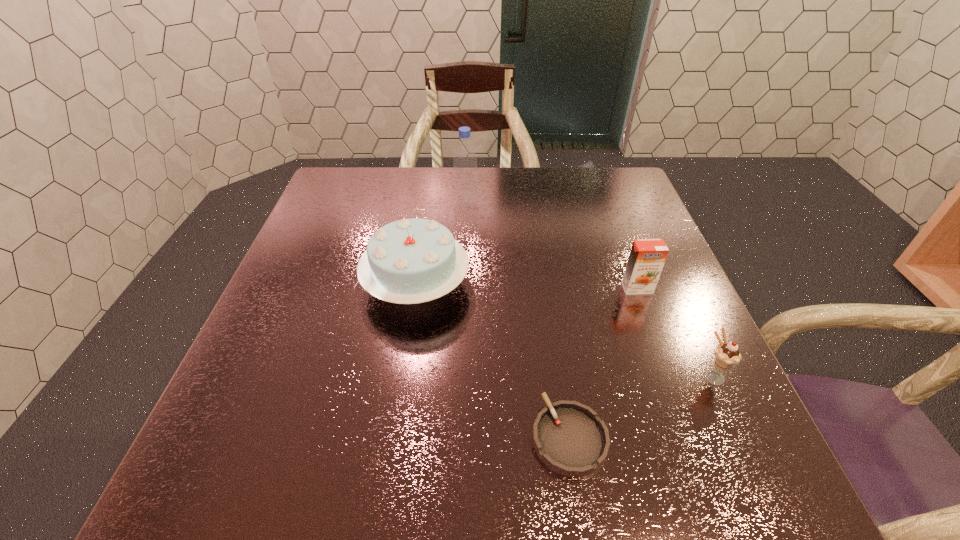
Where is `vacant space situated on the back of the orange juice`? Image resolution: width=960 pixels, height=540 pixels. vacant space situated on the back of the orange juice is located at coordinates (616, 231).

Where is `vacant space positioned 0.280m on the back of the second nearest object`? The width and height of the screenshot is (960, 540). vacant space positioned 0.280m on the back of the second nearest object is located at coordinates (663, 266).

Where is `vacant space located 0.060m on the back of the nearest object`? vacant space located 0.060m on the back of the nearest object is located at coordinates (559, 373).

Where is `object that is at the far edge`? The width and height of the screenshot is (960, 540). object that is at the far edge is located at coordinates (466, 194).

This screenshot has height=540, width=960. Find the location of `object situated at the near edge`. object situated at the near edge is located at coordinates (569, 438).

The width and height of the screenshot is (960, 540). I want to click on orange juice at the right edge, so click(647, 257).

This screenshot has height=540, width=960. I want to click on icecream located at the right edge, so click(x=726, y=355).

Locate an element on the screen. vacant space at the far edge is located at coordinates (415, 194).

Where is `free space at the near edge of the desktop`? free space at the near edge of the desktop is located at coordinates (550, 489).

Identify the location of free space at the left edge of the desktop. (x=237, y=417).